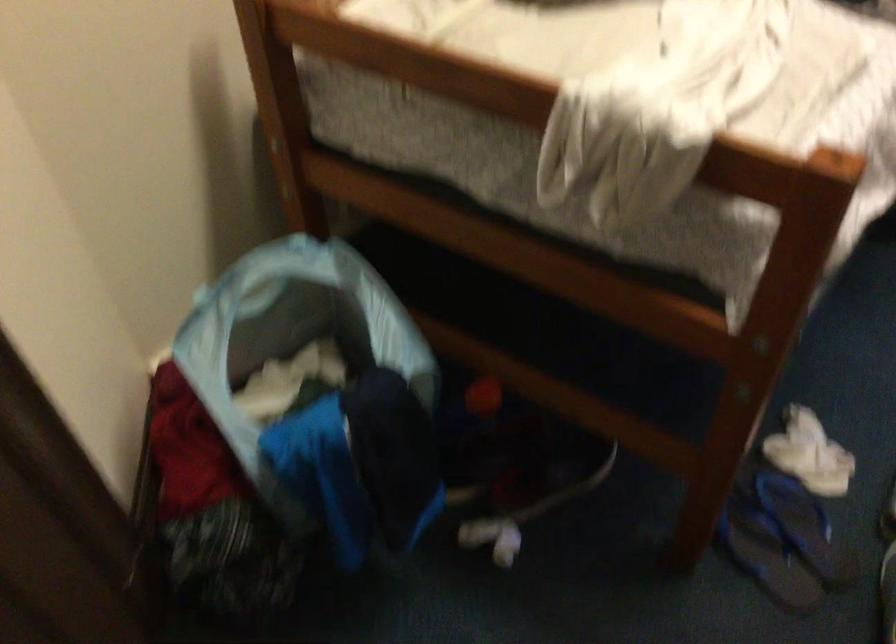
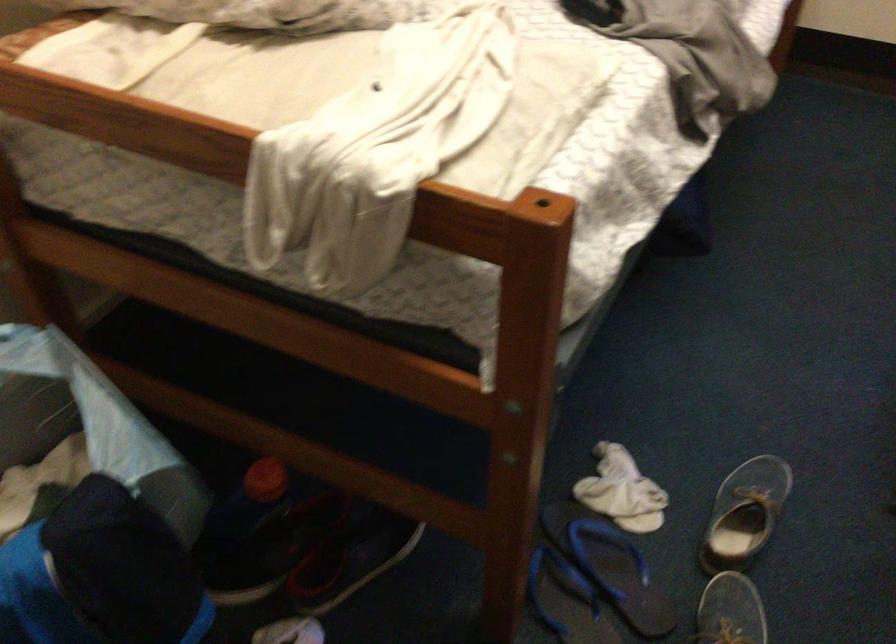
Find the pixel in the second image that matches [793,522] in the first image.

(609, 565)